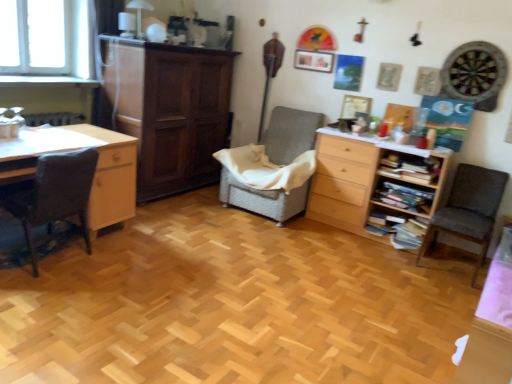
I want to click on vacant space in front of light wood chest of drawers at center right, so click(382, 260).